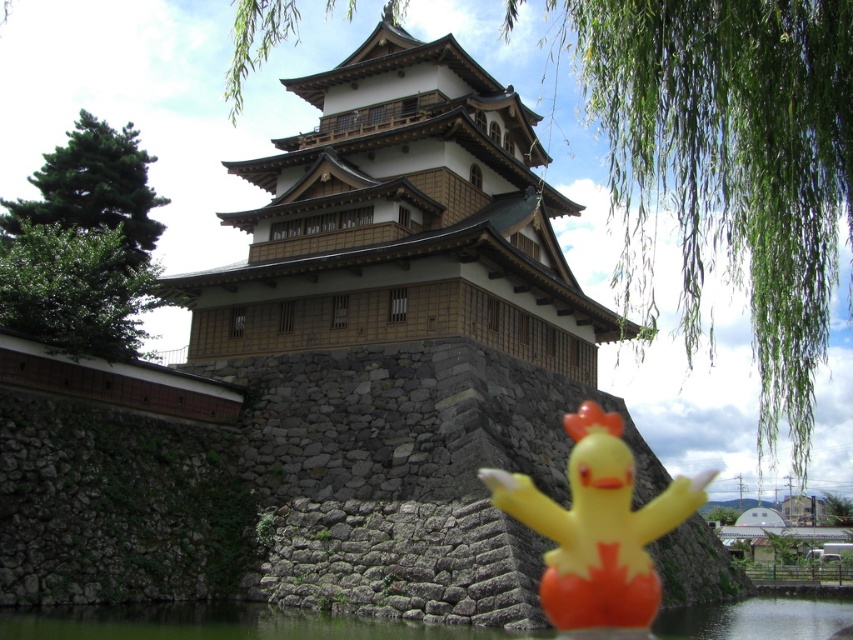
Can you confirm if yellow rubber duck at center is thinner than transparent water at lower center?

Correct, yellow rubber duck at center's width is less than transparent water at lower center's.

Does yellow rubber duck at center appear under transparent water at lower center?

No, yellow rubber duck at center is not below transparent water at lower center.

The height and width of the screenshot is (640, 853). Describe the element at coordinates (598, 531) in the screenshot. I see `yellow rubber duck at center` at that location.

Find the location of a particular element. The image size is (853, 640). yellow rubber duck at center is located at coordinates click(598, 531).